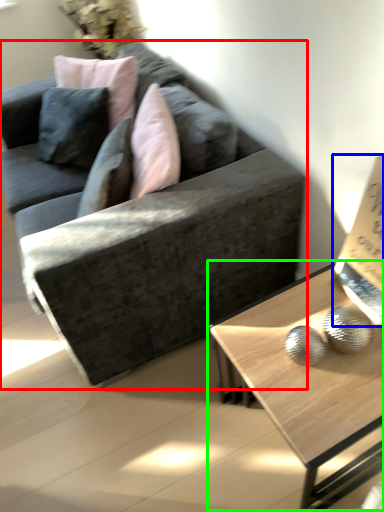
Question: Which object is positioned closest to studio couch (highlighted by a red box)? Select from paperback book (highlighted by a blue box) and coffee table (highlighted by a green box).

Choices:
 (A) paperback book
 (B) coffee table

Answer: (B)